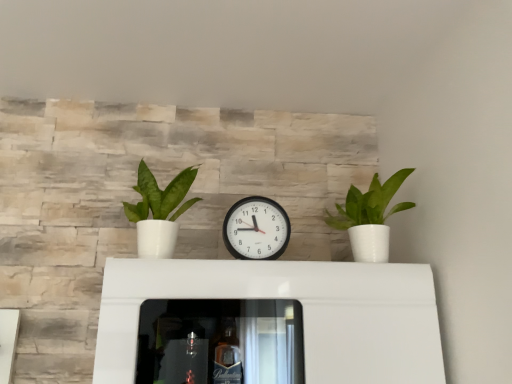
Question: Is white glossy pot at right, the first houseplant when ordered from right to left, at the left side of green matte plant at left, the 2th houseplant from the right?

Choices:
 (A) yes
 (B) no

Answer: (B)

Question: From the image's perspective, is white glossy pot at right, acting as the second houseplant starting from the left, over green matte plant at left, the 2th houseplant from the right?

Choices:
 (A) yes
 (B) no

Answer: (B)

Question: From the image's perspective, is white glossy pot at right, the first houseplant when ordered from right to left, beneath green matte plant at left, the 2th houseplant from the right?

Choices:
 (A) no
 (B) yes

Answer: (B)

Question: Does white glossy pot at right, the first houseplant when ordered from right to left, turn towards green matte plant at left, arranged as the 1th houseplant when viewed from the left?

Choices:
 (A) yes
 (B) no

Answer: (B)

Question: Is white glossy pot at right, the first houseplant when ordered from right to left, not inside green matte plant at left, the 2th houseplant from the right?

Choices:
 (A) no
 (B) yes

Answer: (B)

Question: From a real-world perspective, is white glossy pot at right, the first houseplant when ordered from right to left, beneath green matte plant at left, the 2th houseplant from the right?

Choices:
 (A) yes
 (B) no

Answer: (B)

Question: Is green matte plant at left, arranged as the 1th houseplant when viewed from the left, oriented away from black plastic wall clock at center?

Choices:
 (A) no
 (B) yes

Answer: (A)

Question: Can you confirm if green matte plant at left, the 2th houseplant from the right, is positioned to the left of black plastic wall clock at center?

Choices:
 (A) no
 (B) yes

Answer: (B)

Question: Can you confirm if green matte plant at left, the 2th houseplant from the right, is thinner than black plastic wall clock at center?

Choices:
 (A) yes
 (B) no

Answer: (B)

Question: Is green matte plant at left, arranged as the 1th houseplant when viewed from the left, further to the viewer compared to black plastic wall clock at center?

Choices:
 (A) yes
 (B) no

Answer: (B)

Question: From the image's perspective, would you say green matte plant at left, arranged as the 1th houseplant when viewed from the left, is positioned over black plastic wall clock at center?

Choices:
 (A) no
 (B) yes

Answer: (B)

Question: Is green matte plant at left, arranged as the 1th houseplant when viewed from the left, aimed at black plastic wall clock at center?

Choices:
 (A) no
 (B) yes

Answer: (A)

Question: Is black plastic wall clock at center at the left side of white glossy pot at right, the first houseplant when ordered from right to left?

Choices:
 (A) no
 (B) yes

Answer: (B)